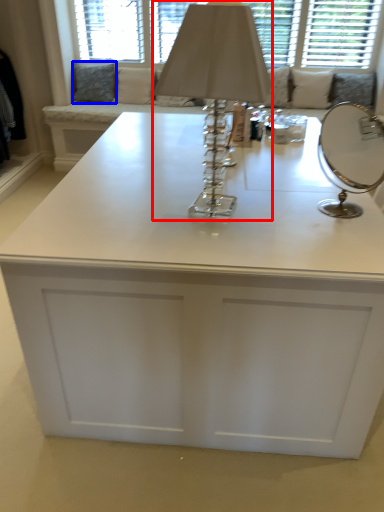
Question: Which object appears farthest to the camera in this image, table lamp (highlighted by a red box) or pillow (highlighted by a blue box)?

Choices:
 (A) table lamp
 (B) pillow

Answer: (B)